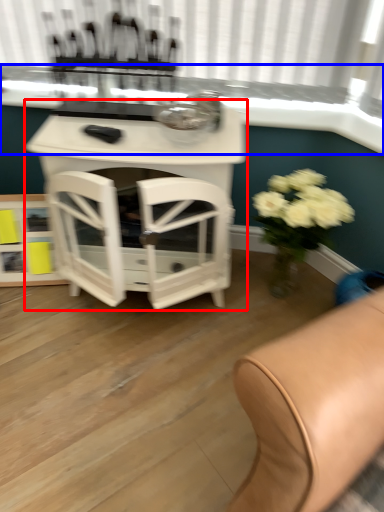
Question: Among these objects, which one is nearest to the camera, table (highlighted by a red box) or window sill (highlighted by a blue box)?

Choices:
 (A) table
 (B) window sill

Answer: (A)